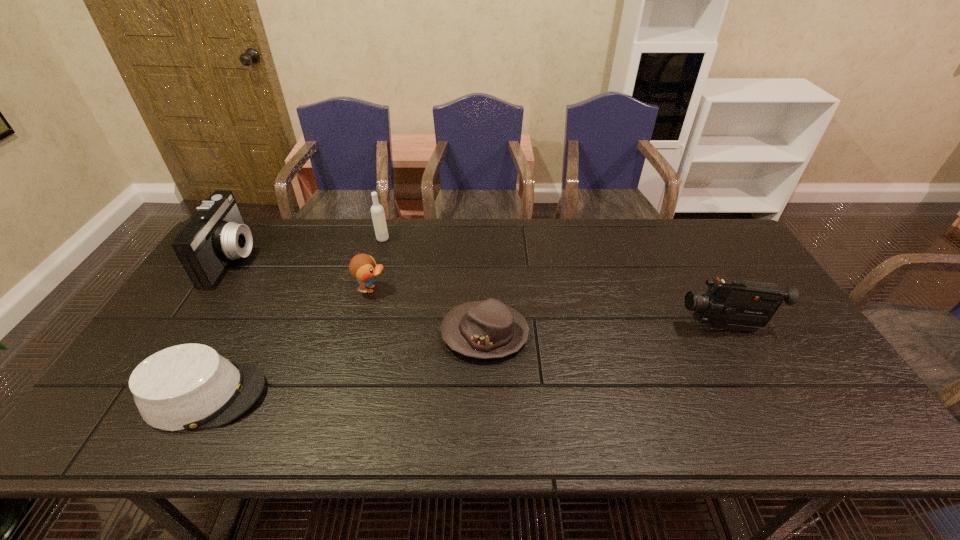
The image size is (960, 540). Identify the location of camcorder that is at the left edge. (216, 232).

Identify the location of hat situated at the left edge. The image size is (960, 540). (190, 386).

Identify the location of object located in the right edge section of the desktop. Image resolution: width=960 pixels, height=540 pixels. (733, 304).

The width and height of the screenshot is (960, 540). In order to click on object that is at the far left corner in this screenshot , I will do `click(216, 232)`.

The image size is (960, 540). Find the location of `object situated at the near left corner`. object situated at the near left corner is located at coordinates (190, 386).

At what (x,y) coordinates should I click in order to perform the action: click on free spot at the far edge of the desktop. Please return your answer as a coordinate pair (x, y). The width and height of the screenshot is (960, 540). Looking at the image, I should click on (412, 229).

At what (x,y) coordinates should I click in order to perform the action: click on free space at the near edge of the desktop. Please return your answer as a coordinate pair (x, y). The width and height of the screenshot is (960, 540). Looking at the image, I should click on (573, 420).

The width and height of the screenshot is (960, 540). In order to click on blank area at the left edge in this screenshot , I will do `click(234, 287)`.

The height and width of the screenshot is (540, 960). I want to click on vacant space at the right edge of the desktop, so click(826, 381).

You are a GUI agent. You are given a task and a screenshot of the screen. Output one action in this format:
    pyautogui.click(x=<x>, y=<y>)
    Task: Click on the vacant space at the far right corner of the desktop
    Image resolution: width=960 pixels, height=540 pixels.
    Given the screenshot: What is the action you would take?
    pyautogui.click(x=690, y=222)